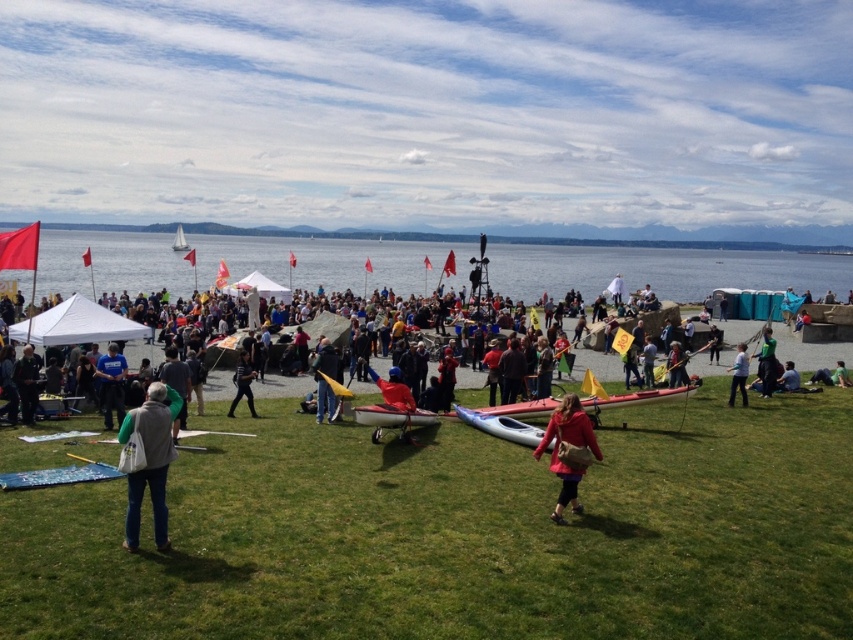
You are standing at the center of the image and want to find the orange fabric kayak at center. According to the coordinates provided, in which direction should you look to locate it?

The orange fabric kayak at center is located at coordinates point (325, 380), so you should look towards the center of the image to find it.

You are a photographer at the event and want to capture both the matte pink coat at center and the blue fabric shirt at center in a single shot. Which clothing item will appear smaller in the photo?

The matte pink coat at center will appear smaller in the photo because it is not as tall as the blue fabric shirt at center.